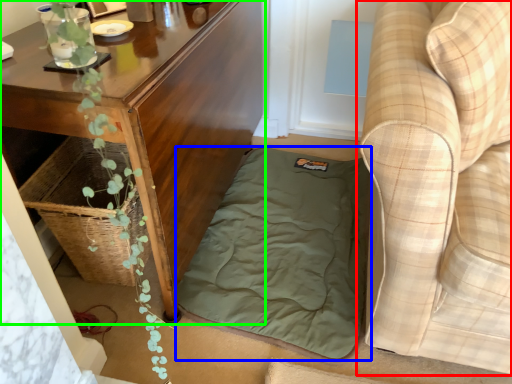
Question: Which object is the closest to the studio couch (highlighted by a red box)? Choose among these: mattress (highlighted by a blue box) or table (highlighted by a green box).

Choices:
 (A) mattress
 (B) table

Answer: (A)